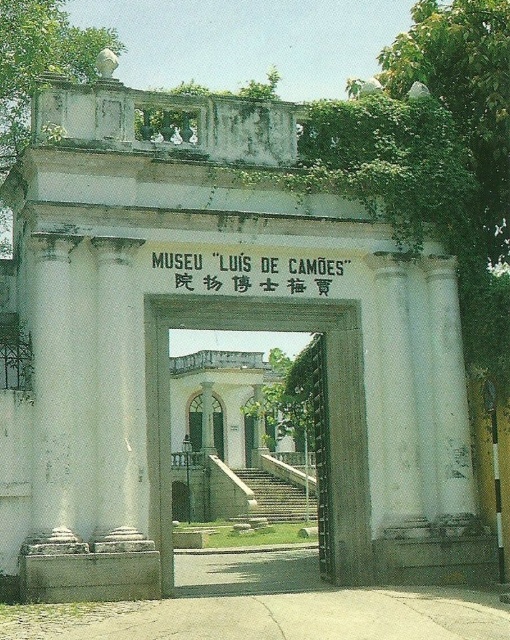
Who is shorter, stone gate at center or white paper sign at center?

white paper sign at center

Is stone gate at center closer to the viewer compared to white paper sign at center?

Yes, stone gate at center is closer to the viewer.

Locate an element on the screen. This screenshot has height=640, width=510. stone gate at center is located at coordinates (326, 406).